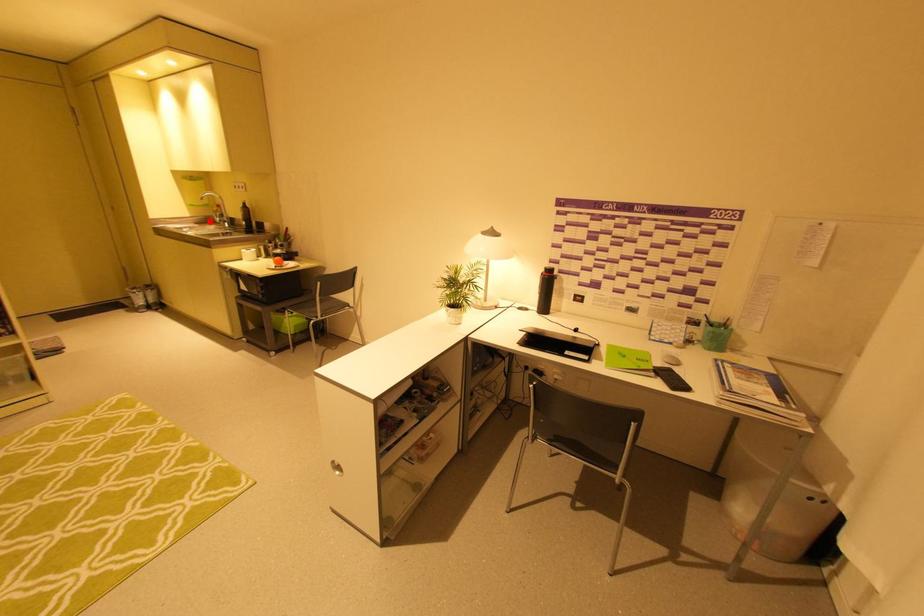
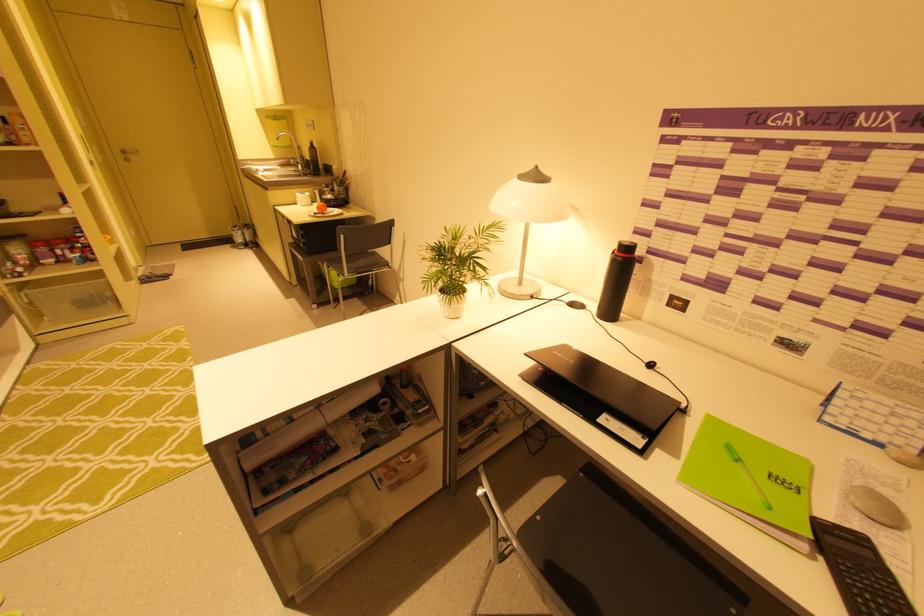
In the second image, find the point that corresponds to the highlighted location in the first image.

(293, 164)